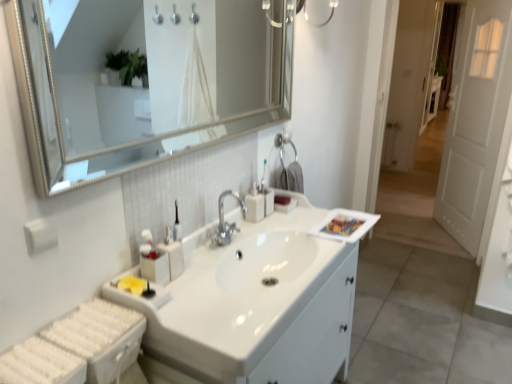
Question: From a real-world perspective, is silver/metallic mirror at upper center on top of white glossy sink at center?

Choices:
 (A) yes
 (B) no

Answer: (A)

Question: Is white glossy sink at center completely or partially inside silver/metallic mirror at upper center?

Choices:
 (A) no
 (B) yes

Answer: (A)

Question: Is silver/metallic mirror at upper center not near white glossy sink at center?

Choices:
 (A) no
 (B) yes

Answer: (B)

Question: Is silver/metallic mirror at upper center outside of white glossy sink at center?

Choices:
 (A) no
 (B) yes

Answer: (B)

Question: Can you confirm if silver/metallic mirror at upper center is smaller than white glossy sink at center?

Choices:
 (A) yes
 (B) no

Answer: (A)

Question: Is silver/metallic mirror at upper center to the left of white glossy sink at center from the viewer's perspective?

Choices:
 (A) yes
 (B) no

Answer: (A)

Question: Is silver/metallic mirror at upper center not within white wooden door at right?

Choices:
 (A) yes
 (B) no

Answer: (A)

Question: Does silver/metallic mirror at upper center come in front of white wooden door at right?

Choices:
 (A) yes
 (B) no

Answer: (A)

Question: From a real-world perspective, is silver/metallic mirror at upper center under white wooden door at right?

Choices:
 (A) yes
 (B) no

Answer: (B)

Question: From a real-world perspective, is silver/metallic mirror at upper center positioned over white wooden door at right based on gravity?

Choices:
 (A) yes
 (B) no

Answer: (A)

Question: Considering the relative positions of silver/metallic mirror at upper center and white wooden door at right in the image provided, is silver/metallic mirror at upper center to the left of white wooden door at right from the viewer's perspective?

Choices:
 (A) yes
 (B) no

Answer: (A)

Question: Can you confirm if silver/metallic mirror at upper center is shorter than white wooden door at right?

Choices:
 (A) yes
 (B) no

Answer: (A)

Question: Does white glossy sink at center have a smaller size compared to satin silver soap dispenser at center?

Choices:
 (A) yes
 (B) no

Answer: (B)